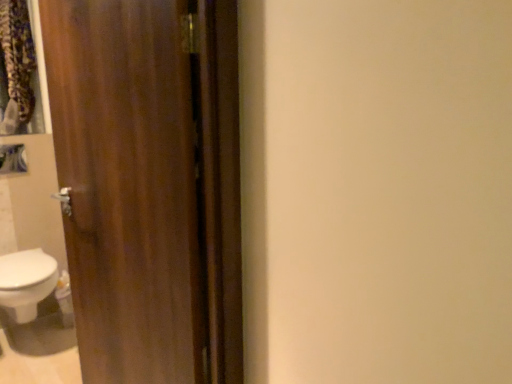
Question: In the image, is white glossy bidet at lower left positioned in front of or behind wooden door at left?

Choices:
 (A) front
 (B) behind

Answer: (B)

Question: Is white glossy bidet at lower left to the left or to the right of wooden door at left in the image?

Choices:
 (A) right
 (B) left

Answer: (B)

Question: From the image's perspective, relative to wooden door at left, is white glossy bidet at lower left above or below?

Choices:
 (A) below
 (B) above

Answer: (A)

Question: Looking at their shapes, would you say wooden door at left is wider or thinner than white glossy bidet at lower left?

Choices:
 (A) wide
 (B) thin

Answer: (B)

Question: In the image, is wooden door at left on the left side or the right side of white glossy bidet at lower left?

Choices:
 (A) left
 (B) right

Answer: (B)

Question: Is wooden door at left in front of or behind white glossy bidet at lower left in the image?

Choices:
 (A) front
 (B) behind

Answer: (A)

Question: From a real-world perspective, is wooden door at left above or below white glossy bidet at lower left?

Choices:
 (A) above
 (B) below

Answer: (A)